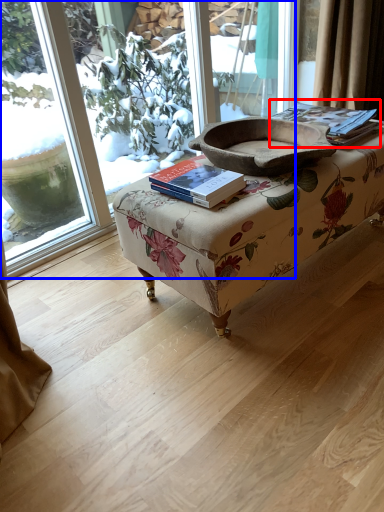
Question: Which object is further to the camera taking this photo, paperback book (highlighted by a red box) or window (highlighted by a blue box)?

Choices:
 (A) paperback book
 (B) window

Answer: (A)